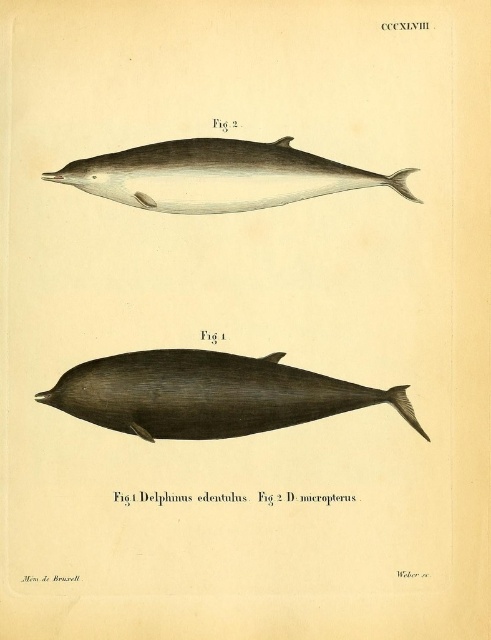
Is dark gray smooth dolphin at bottom positioned at the back of smooth gray dolphin at upper center?

That is False.

Who is higher up, dark gray smooth dolphin at bottom or smooth gray dolphin at upper center?

Positioned higher is smooth gray dolphin at upper center.

Image resolution: width=491 pixels, height=640 pixels. Identify the location of dark gray smooth dolphin at bottom. (208, 394).